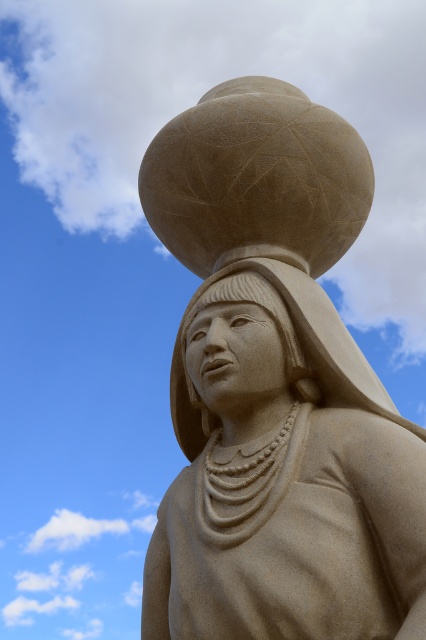
Who is lower down, beige stone sphere at upper center or sandy beige statue at center?

Positioned lower is sandy beige statue at center.

What do you see at coordinates (276, 388) in the screenshot?
I see `beige stone sphere at upper center` at bounding box center [276, 388].

Is point (175, 484) behind point (275, 412)?

Yes, point (175, 484) is behind point (275, 412).

At what (x,y) coordinates should I click in order to perform the action: click on beige stone sphere at upper center. Please return your answer as a coordinate pair (x, y). The width and height of the screenshot is (426, 640). Looking at the image, I should click on [276, 388].